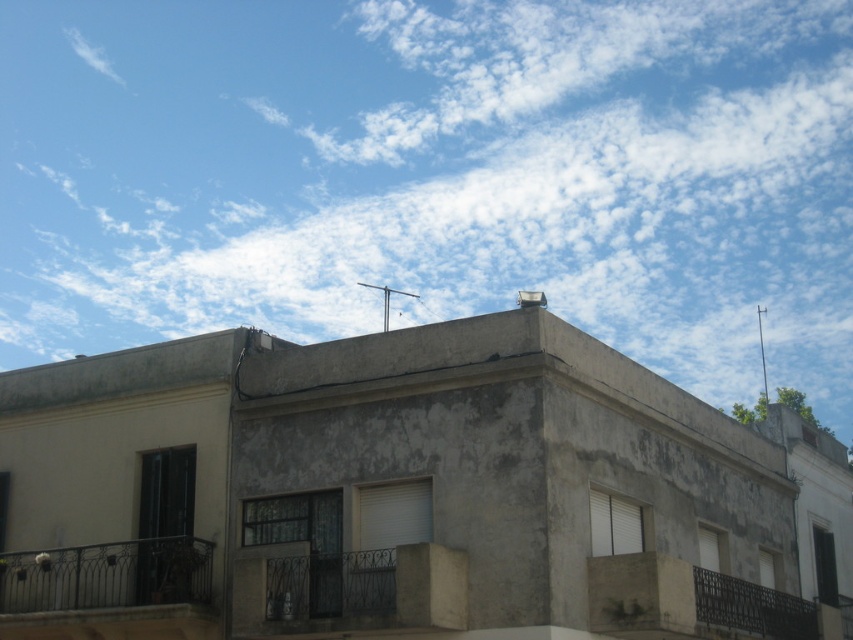
Question: Which object is farther from the camera taking this photo?

Choices:
 (A) white fluffy cloud at upper center
 (B) dark gray metal balcony at center
 (C) dark gray wrought iron balcony at lower left

Answer: (A)

Question: Does dark gray metal balcony at center come in front of black wrought iron balcony at lower right?

Choices:
 (A) yes
 (B) no

Answer: (B)

Question: Which object is the closest to the dark gray metal balcony at center?

Choices:
 (A) black wrought iron balcony at lower right
 (B) white fluffy cloud at upper center

Answer: (A)

Question: Is dark gray wrought iron balcony at lower left positioned in front of black wrought iron balcony at lower right?

Choices:
 (A) yes
 (B) no

Answer: (B)

Question: Which of these objects is positioned closest to the dark gray wrought iron balcony at lower left?

Choices:
 (A) dark gray metal balcony at center
 (B) white fluffy cloud at upper center
 (C) black wrought iron balcony at lower right

Answer: (A)

Question: Can you confirm if dark gray wrought iron balcony at lower left is thinner than dark gray metal balcony at center?

Choices:
 (A) no
 (B) yes

Answer: (B)